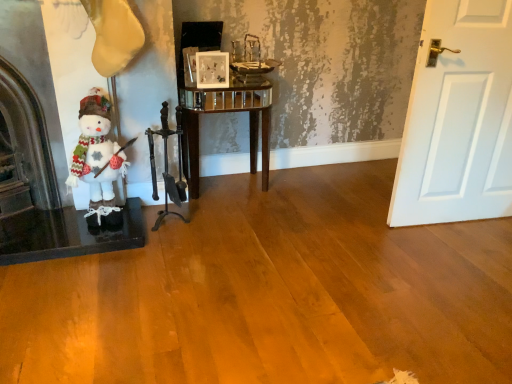
Where is `vacant space to the right of dark brown polished wood fireplace tools at center`? The image size is (512, 384). vacant space to the right of dark brown polished wood fireplace tools at center is located at coordinates (211, 228).